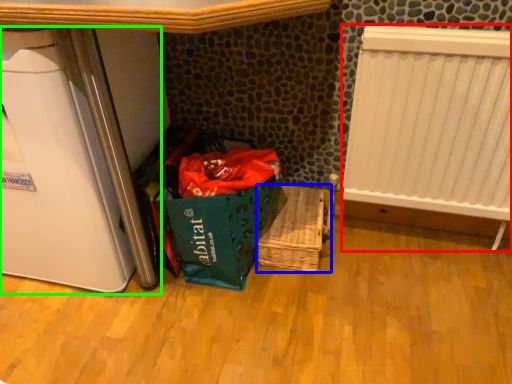
Question: Which object is positioned closest to radiator (highlighted by a red box)? Select from basket (highlighted by a blue box) and appliance (highlighted by a green box).

Choices:
 (A) basket
 (B) appliance

Answer: (A)